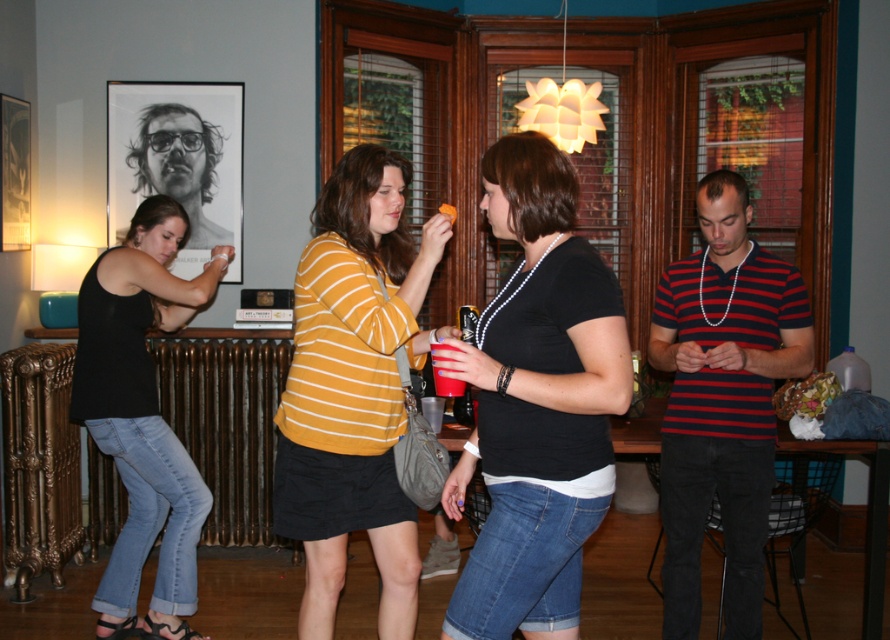
You are at a party and want to take a photo with both the striped cotton shirt at right and the matte black portrait at upper left in the frame. Which direction should you move to ensure both are visible?

Move to the left so that the striped cotton shirt at right and the matte black portrait at upper left can be captured in the same frame since the striped cotton shirt at right is to the right of the matte black portrait at upper left.

You are at a party and want to take a photo of both the black denim jeans at left and the matte black portrait at upper left. Which object should you point your camera towards first to include both in the frame?

You should point your camera towards the matte black portrait at upper left first since the black denim jeans at left is to the right of it, ensuring both are captured in the frame.